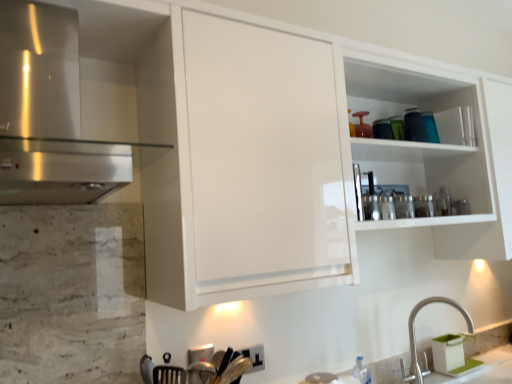
Question: Considering the relative sizes of satin nickel faucet at lower right and stainless steel range hood at left in the image provided, is satin nickel faucet at lower right shorter than stainless steel range hood at left?

Choices:
 (A) yes
 (B) no

Answer: (A)

Question: Is satin nickel faucet at lower right outside of stainless steel range hood at left?

Choices:
 (A) no
 (B) yes

Answer: (B)

Question: Is satin nickel faucet at lower right wider than stainless steel range hood at left?

Choices:
 (A) yes
 (B) no

Answer: (B)

Question: Does satin nickel faucet at lower right come behind stainless steel range hood at left?

Choices:
 (A) yes
 (B) no

Answer: (A)

Question: Is satin nickel faucet at lower right positioned in front of stainless steel range hood at left?

Choices:
 (A) yes
 (B) no

Answer: (B)

Question: From the image's perspective, would you say satin nickel faucet at lower right is positioned over stainless steel range hood at left?

Choices:
 (A) yes
 (B) no

Answer: (B)

Question: Is satin nickel faucet at lower right completely or partially inside stainless steel range hood at left?

Choices:
 (A) no
 (B) yes

Answer: (A)

Question: From a real-world perspective, is stainless steel range hood at left physically above satin nickel faucet at lower right?

Choices:
 (A) no
 (B) yes

Answer: (B)

Question: From the image's perspective, would you say stainless steel range hood at left is positioned over satin nickel faucet at lower right?

Choices:
 (A) no
 (B) yes

Answer: (B)

Question: Does stainless steel range hood at left lie behind satin nickel faucet at lower right?

Choices:
 (A) no
 (B) yes

Answer: (A)

Question: Is stainless steel range hood at left beside satin nickel faucet at lower right?

Choices:
 (A) no
 (B) yes

Answer: (A)

Question: Does stainless steel range hood at left have a lesser height compared to satin nickel faucet at lower right?

Choices:
 (A) no
 (B) yes

Answer: (A)

Question: Looking at their shapes, would you say stainless steel range hood at left is wider or thinner than satin nickel faucet at lower right?

Choices:
 (A) wide
 (B) thin

Answer: (A)